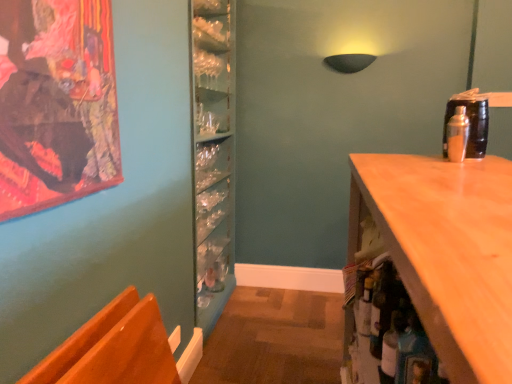
How much space does translucent glass bottle at lower right, which appears as the 1th bottle when viewed from the left, occupy horizontally?

translucent glass bottle at lower right, which appears as the 1th bottle when viewed from the left, is 4.37 inches in width.

At what (x,y) coordinates should I click in order to perform the action: click on metallic silver shaker at upper right, arranged as the second bottle when viewed from the left. Please return your answer as a coordinate pair (x, y). This screenshot has height=384, width=512. Looking at the image, I should click on (457, 135).

The width and height of the screenshot is (512, 384). What are the coordinates of `translucent glass bottle at lower right, which appears as the first bottle when ordered from the bottom` in the screenshot? It's located at (382, 307).

From a real-world perspective, is metallic silver shaker at upper right, the second bottle ordered from the bottom, physically located above or below translucent glass bottle at lower right, which is the first bottle from front to back?

metallic silver shaker at upper right, the second bottle ordered from the bottom, is situated higher than translucent glass bottle at lower right, which is the first bottle from front to back, in the real world.

Relative to translucent glass bottle at lower right, which appears as the first bottle when ordered from the bottom, is metallic silver shaker at upper right, positioned as the 1th bottle in top-to-bottom order, in front or behind?

Visually, metallic silver shaker at upper right, positioned as the 1th bottle in top-to-bottom order, is located behind translucent glass bottle at lower right, which appears as the first bottle when ordered from the bottom.

Which of these two, metallic silver shaker at upper right, arranged as the first bottle when viewed from the right, or translucent glass bottle at lower right, which appears as the first bottle when ordered from the bottom, is bigger?

translucent glass bottle at lower right, which appears as the first bottle when ordered from the bottom.

Could you tell me if translucent glass bottle at lower right, which appears as the first bottle when ordered from the bottom, is facing metallic silver shaker at upper right, arranged as the first bottle when viewed from the right?

No, translucent glass bottle at lower right, which appears as the first bottle when ordered from the bottom, is not facing towards metallic silver shaker at upper right, arranged as the first bottle when viewed from the right.

Based on their sizes in the image, would you say translucent glass bottle at lower right, which ranks as the 2th bottle in top-to-bottom order, is bigger or smaller than metallic silver shaker at upper right, the second bottle ordered from the bottom?

translucent glass bottle at lower right, which ranks as the 2th bottle in top-to-bottom order, is bigger than metallic silver shaker at upper right, the second bottle ordered from the bottom.

Between translucent glass bottle at lower right, which ranks as the 2th bottle in top-to-bottom order, and metallic silver shaker at upper right, arranged as the second bottle when viewed from the left, which one is positioned in front?

translucent glass bottle at lower right, which ranks as the 2th bottle in top-to-bottom order, is closer to the camera.

From the image's perspective, is translucent glass bottle at lower right, which is the first bottle from front to back, beneath shiny orange chair at lower left?

No, from the image's perspective, translucent glass bottle at lower right, which is the first bottle from front to back, is not beneath shiny orange chair at lower left.

Considering the positions of objects translucent glass bottle at lower right, which appears as the 1th bottle when viewed from the left, and shiny orange chair at lower left in the image provided, who is more to the left, translucent glass bottle at lower right, which appears as the 1th bottle when viewed from the left, or shiny orange chair at lower left?

Positioned to the left is shiny orange chair at lower left.

From a real-world perspective, is translucent glass bottle at lower right, which ranks as the 2th bottle in top-to-bottom order, located beneath shiny orange chair at lower left?

No, from a real-world perspective, translucent glass bottle at lower right, which ranks as the 2th bottle in top-to-bottom order, is not below shiny orange chair at lower left.

How far apart are translucent glass bottle at lower right, which is the first bottle from front to back, and shiny orange chair at lower left?

translucent glass bottle at lower right, which is the first bottle from front to back, is 28.26 inches away from shiny orange chair at lower left.

From the image's perspective, is metallic silver shaker at upper right, arranged as the second bottle when viewed from the left, located above or below shiny orange chair at lower left?

Based on their image positions, metallic silver shaker at upper right, arranged as the second bottle when viewed from the left, is located above shiny orange chair at lower left.

Is metallic silver shaker at upper right, the second bottle in the front-to-back sequence, wider than shiny orange chair at lower left?

Incorrect, the width of metallic silver shaker at upper right, the second bottle in the front-to-back sequence, does not surpass that of shiny orange chair at lower left.

Consider the image. Is metallic silver shaker at upper right, arranged as the second bottle when viewed from the left, surrounding shiny orange chair at lower left?

That's incorrect, shiny orange chair at lower left is not inside metallic silver shaker at upper right, arranged as the second bottle when viewed from the left.

What's the angular difference between shiny orange chair at lower left and translucent glass bottle at lower right, which is the first bottle from front to back,'s facing directions?

The angular difference between shiny orange chair at lower left and translucent glass bottle at lower right, which is the first bottle from front to back, is 179 degrees.

From the image's perspective, is shiny orange chair at lower left below translucent glass bottle at lower right, which is the first bottle from front to back?

Yes.

How distant is shiny orange chair at lower left from translucent glass bottle at lower right, which appears as the first bottle when ordered from the bottom?

They are 28.26 inches apart.

From the shiny orange chair at lower left, count 1st bottles backward and point to it. Please provide its 2D coordinates.

[(382, 307)]

Based on their positions, is shiny orange chair at lower left located to the left or right of metallic silver shaker at upper right, the second bottle in the front-to-back sequence?

shiny orange chair at lower left is to the left of metallic silver shaker at upper right, the second bottle in the front-to-back sequence.

Is shiny orange chair at lower left beside metallic silver shaker at upper right, arranged as the first bottle when viewed from the right?

No, shiny orange chair at lower left is not making contact with metallic silver shaker at upper right, arranged as the first bottle when viewed from the right.

How many degrees apart are the facing directions of shiny orange chair at lower left and metallic silver shaker at upper right, acting as the 1th bottle starting from the back?

They differ by 0.835 degrees in their facing directions.

Is shiny orange chair at lower left wider than metallic silver shaker at upper right, positioned as the 1th bottle in top-to-bottom order?

Correct, the width of shiny orange chair at lower left exceeds that of metallic silver shaker at upper right, positioned as the 1th bottle in top-to-bottom order.

The width and height of the screenshot is (512, 384). In order to click on bottle above the translucent glass bottle at lower right, which is the first bottle from front to back (from the image's perspective) in this screenshot , I will do `click(457, 135)`.

In order to click on bottle that is below the metallic silver shaker at upper right, acting as the 1th bottle starting from the back (from the image's perspective) in this screenshot , I will do `click(382, 307)`.

Considering their positions, is translucent glass bottle at lower right, which appears as the 1th bottle when viewed from the left, positioned further to shiny orange chair at lower left than metallic silver shaker at upper right, the second bottle ordered from the bottom?

The object further to shiny orange chair at lower left is metallic silver shaker at upper right, the second bottle ordered from the bottom.

Looking at the image, which one is located closer to translucent glass bottle at lower right, which appears as the first bottle when ordered from the bottom, shiny orange chair at lower left or metallic silver shaker at upper right, positioned as the 1th bottle in top-to-bottom order?

Among the two, metallic silver shaker at upper right, positioned as the 1th bottle in top-to-bottom order, is located nearer to translucent glass bottle at lower right, which appears as the first bottle when ordered from the bottom.

Considering their positions, is metallic silver shaker at upper right, the second bottle in the front-to-back sequence, positioned closer to shiny orange chair at lower left than translucent glass bottle at lower right, the second bottle positioned from the back?

Among the two, translucent glass bottle at lower right, the second bottle positioned from the back, is located nearer to shiny orange chair at lower left.

When comparing their distances from metallic silver shaker at upper right, acting as the 1th bottle starting from the back, does translucent glass bottle at lower right, which ranks as the 2th bottle in top-to-bottom order, or shiny orange chair at lower left seem further?

shiny orange chair at lower left is positioned further to the anchor metallic silver shaker at upper right, acting as the 1th bottle starting from the back.

When comparing their distances from translucent glass bottle at lower right, which is the first bottle from front to back, does metallic silver shaker at upper right, positioned as the 1th bottle in top-to-bottom order, or shiny orange chair at lower left seem further?

Among the two, shiny orange chair at lower left is located further to translucent glass bottle at lower right, which is the first bottle from front to back.

Based on the photo, looking at the image, which one is located further to metallic silver shaker at upper right, arranged as the first bottle when viewed from the right, shiny orange chair at lower left or translucent glass bottle at lower right, which ranks as the 2th bottle in top-to-bottom order?

shiny orange chair at lower left is positioned further to the anchor metallic silver shaker at upper right, arranged as the first bottle when viewed from the right.

Image resolution: width=512 pixels, height=384 pixels. I want to click on bottle located between shiny orange chair at lower left and metallic silver shaker at upper right, arranged as the first bottle when viewed from the right, in the left-right direction, so click(x=382, y=307).